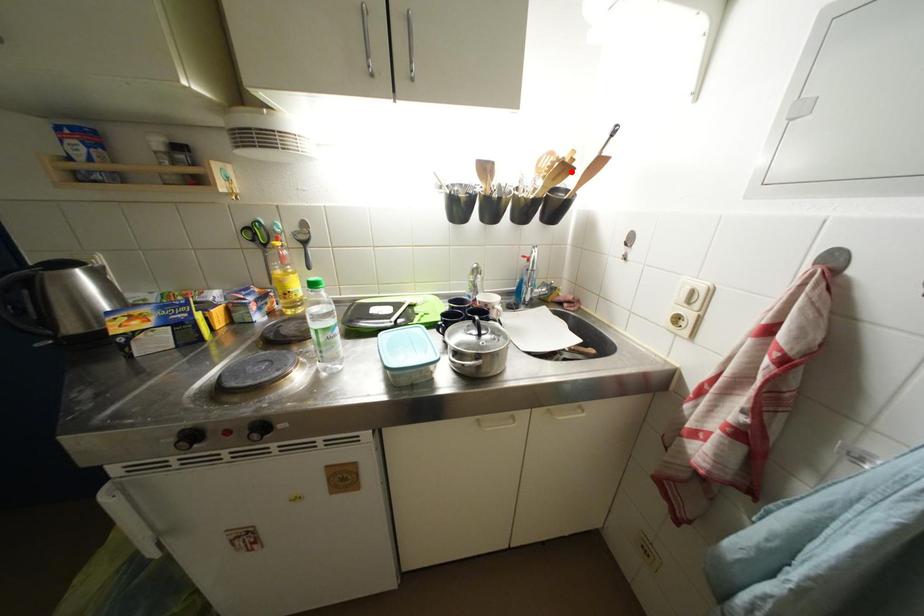
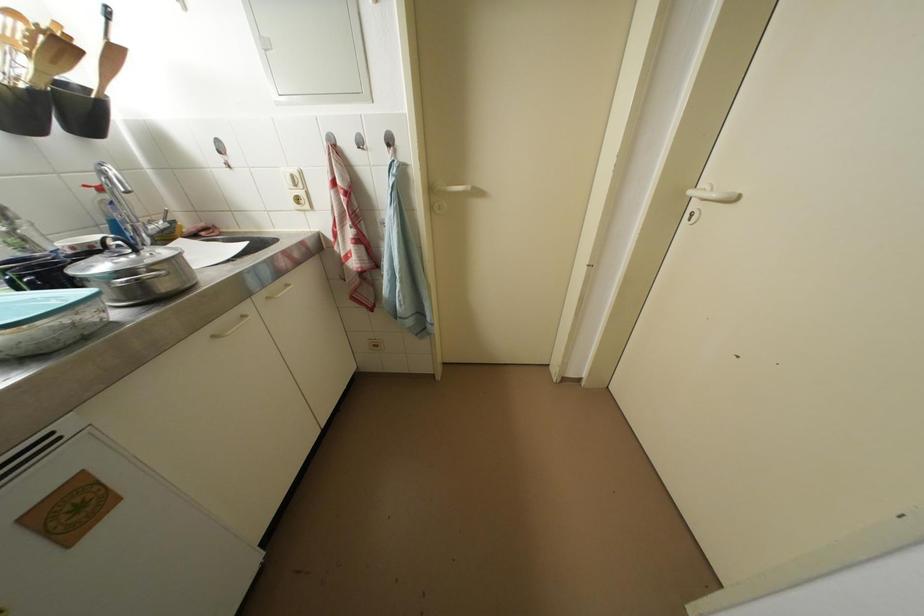
In the second image, find the point that corresponds to the highlighted location in the first image.

(69, 50)